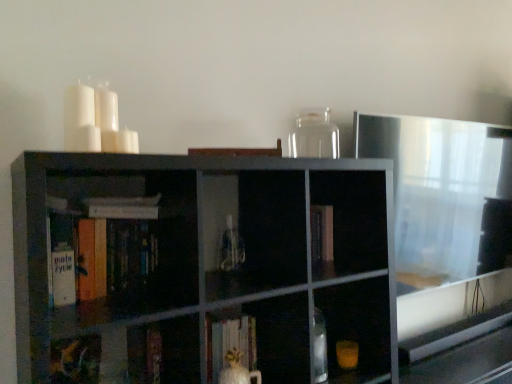
Locate an element on the screen. transparent glass jar at upper center is located at coordinates (314, 135).

The width and height of the screenshot is (512, 384). What do you see at coordinates (314, 135) in the screenshot? I see `transparent glass jar at upper center` at bounding box center [314, 135].

Identify the location of white matte book at upper left, acting as the 2th book starting from the top. (123, 207).

Describe the element at coordinates (229, 344) in the screenshot. This screenshot has height=384, width=512. I see `white matte book at center, positioned as the fourth book in top-to-bottom order` at that location.

Find the location of a particular element. This screenshot has height=384, width=512. white matte book at left, placed as the 3th book when sorted from top to bottom is located at coordinates (101, 245).

I want to click on hardcover book at center, which appears as the 1th book when viewed from the top, so click(65, 206).

Identify the location of white matte candle at upper left, the 2th candle positioned from the right. This screenshot has height=384, width=512. (80, 120).

Could you tell me if white matte candle at upper left, which ranks as the 2th candle in left-to-right order, is facing white matte book at center, placed as the second book when sorted from bottom to top?

No, white matte candle at upper left, which ranks as the 2th candle in left-to-right order, does not turn towards white matte book at center, placed as the second book when sorted from bottom to top.

Is white matte candle at upper left, the first candle positioned from the right, thinner than white matte book at center, positioned as the fourth book in top-to-bottom order?

Yes, white matte candle at upper left, the first candle positioned from the right, is thinner than white matte book at center, positioned as the fourth book in top-to-bottom order.

Who is smaller, white matte candle at upper left, which ranks as the 2th candle in left-to-right order, or white matte book at center, placed as the second book when sorted from bottom to top?

With smaller size is white matte candle at upper left, which ranks as the 2th candle in left-to-right order.

In the scene shown: Can you confirm if white matte candle at upper left, which ranks as the 2th candle in left-to-right order, is shorter than white matte book at center, placed as the second book when sorted from bottom to top?

Yes.

Is matte green book at lower left, the fifth book from the top, looking in the opposite direction of white matte candle at upper left, the 2th candle positioned from the right?

No.

Is point (82, 349) closer or farther from the camera than point (70, 100)?

Clearly, point (82, 349) is more distant from the camera than point (70, 100).

This screenshot has width=512, height=384. In order to click on the 2nd candle positioned above the matte green book at lower left, the 1th book positioned from the bottom (from a real-world perspective) in this screenshot , I will do `click(80, 120)`.

Could you tell me if transparent glass jar at upper center is turned towards white matte candle at upper left, the first candle positioned from the right?

No, transparent glass jar at upper center is not aimed at white matte candle at upper left, the first candle positioned from the right.

From a real-world perspective, which is physically above, transparent glass jar at upper center or white matte candle at upper left, the first candle positioned from the right?

From a 3D spatial view, transparent glass jar at upper center is above.

What's the angular difference between transparent glass jar at upper center and white matte candle at upper left, the first candle positioned from the right,'s facing directions?

The angular difference between transparent glass jar at upper center and white matte candle at upper left, the first candle positioned from the right, is 36.4 degrees.

Which point is more forward, (314,131) or (124,151)?

The point (124,151) is in front.

Can hardcover book at center, which is counted as the 5th book, starting from the bottom, be found inside white matte book at center, placed as the second book when sorted from bottom to top?

No, white matte book at center, placed as the second book when sorted from bottom to top, does not contain hardcover book at center, which is counted as the 5th book, starting from the bottom.

Does white matte book at center, positioned as the fourth book in top-to-bottom order, have a smaller size compared to hardcover book at center, which is counted as the 5th book, starting from the bottom?

Actually, white matte book at center, positioned as the fourth book in top-to-bottom order, might be larger than hardcover book at center, which is counted as the 5th book, starting from the bottom.

Measure the distance from white matte book at center, positioned as the fourth book in top-to-bottom order, to hardcover book at center, which is counted as the 5th book, starting from the bottom.

They are 24.36 inches apart.

Can you tell me how much white matte book at center, positioned as the fourth book in top-to-bottom order, and hardcover book at center, which is counted as the 5th book, starting from the bottom, differ in facing direction?

The angle between the facing direction of white matte book at center, positioned as the fourth book in top-to-bottom order, and the facing direction of hardcover book at center, which is counted as the 5th book, starting from the bottom, is 0.000618 degrees.

The height and width of the screenshot is (384, 512). Identify the location of book that is the 2nd one below the matte black bookshelf at center (from a real-world perspective). pos(229,344).

What's the angular difference between white matte book at center, placed as the second book when sorted from bottom to top, and matte black bookshelf at center's facing directions?

The angle between the facing direction of white matte book at center, placed as the second book when sorted from bottom to top, and the facing direction of matte black bookshelf at center is 2.88 degrees.

Who is taller, white matte book at center, placed as the second book when sorted from bottom to top, or matte black bookshelf at center?

Standing taller between the two is matte black bookshelf at center.

From the image's perspective, which one is positioned lower, white matte book at center, placed as the second book when sorted from bottom to top, or matte black bookshelf at center?

white matte book at center, placed as the second book when sorted from bottom to top, from the image's perspective.

Which of these two, white matte candle at upper left, which ranks as the 2th candle in left-to-right order, or white matte candle at upper left, the 2th candle positioned from the right, is bigger?

Bigger between the two is white matte candle at upper left, the 2th candle positioned from the right.

Can you confirm if white matte candle at upper left, the first candle positioned from the right, is positioned to the left of white matte candle at upper left, the 2th candle positioned from the right?

No, white matte candle at upper left, the first candle positioned from the right, is not to the left of white matte candle at upper left, the 2th candle positioned from the right.

Considering the sizes of white matte candle at upper left, which ranks as the 2th candle in left-to-right order, and white matte candle at upper left, which appears as the first candle when viewed from the left, in the image, is white matte candle at upper left, which ranks as the 2th candle in left-to-right order, taller or shorter than white matte candle at upper left, which appears as the first candle when viewed from the left,?

Clearly, white matte candle at upper left, which ranks as the 2th candle in left-to-right order, is shorter compared to white matte candle at upper left, which appears as the first candle when viewed from the left.

Are white matte candle at upper left, the first candle positioned from the right, and white matte candle at upper left, which appears as the first candle when viewed from the left, far apart?

Actually, white matte candle at upper left, the first candle positioned from the right, and white matte candle at upper left, which appears as the first candle when viewed from the left, are a little close together.

Considering the relative sizes of white matte candle at upper left, the first candle positioned from the right, and matte black bookshelf at center in the image provided, is white matte candle at upper left, the first candle positioned from the right, taller than matte black bookshelf at center?

In fact, white matte candle at upper left, the first candle positioned from the right, may be shorter than matte black bookshelf at center.

From the image's perspective, relative to matte black bookshelf at center, is white matte candle at upper left, the first candle positioned from the right, above or below?

white matte candle at upper left, the first candle positioned from the right, is above matte black bookshelf at center.

Is white matte candle at upper left, which ranks as the 2th candle in left-to-right order, smaller than matte black bookshelf at center?

Correct, white matte candle at upper left, which ranks as the 2th candle in left-to-right order, occupies less space than matte black bookshelf at center.

From a real-world perspective, is white matte candle at upper left, which ranks as the 2th candle in left-to-right order, under matte black bookshelf at center?

No, from a real-world perspective, white matte candle at upper left, which ranks as the 2th candle in left-to-right order, is not below matte black bookshelf at center.

From the image's perspective, count 1st candles upward from the white matte book at center, placed as the second book when sorted from bottom to top, and point to it. Please provide its 2D coordinates.

[(127, 141)]

This screenshot has width=512, height=384. Identify the location of the 2nd candle in front of the matte green book at lower left, the 1th book positioned from the bottom. (80, 120).

Estimate the real-world distances between objects in this image. Which object is closer to matte black bookshelf at center, white matte candle at upper left, which ranks as the 2th candle in left-to-right order, or white matte candle at upper left, which appears as the first candle when viewed from the left?

Based on the image, white matte candle at upper left, which ranks as the 2th candle in left-to-right order, appears to be nearer to matte black bookshelf at center.

Looking at the image, which one is located closer to white matte book at center, positioned as the fourth book in top-to-bottom order, matte green book at lower left, the fifth book from the top, or hardcover book at center, which appears as the 1th book when viewed from the top?

The object closer to white matte book at center, positioned as the fourth book in top-to-bottom order, is matte green book at lower left, the fifth book from the top.

From the picture: Which object lies further to the anchor point white matte candle at upper left, which appears as the first candle when viewed from the left, white matte candle at upper left, the first candle positioned from the right, or white matte book at left, the third book in the bottom-to-top sequence?

Among the two, white matte book at left, the third book in the bottom-to-top sequence, is located further to white matte candle at upper left, which appears as the first candle when viewed from the left.

From the image, which object appears to be nearer to transparent glass jar at upper center, white matte book at center, placed as the second book when sorted from bottom to top, or white matte book at left, placed as the 3th book when sorted from top to bottom?

white matte book at center, placed as the second book when sorted from bottom to top, is closer to transparent glass jar at upper center.

From the image, which object appears to be farther from transparent glass jar at upper center, hardcover book at center, which is counted as the 5th book, starting from the bottom, or matte black bookshelf at center?

hardcover book at center, which is counted as the 5th book, starting from the bottom, is further to transparent glass jar at upper center.

Which object lies nearer to the anchor point white matte candle at upper left, the 2th candle positioned from the right, white matte candle at upper left, the first candle positioned from the right, or hardcover book at center, which is counted as the 5th book, starting from the bottom?

Based on the image, white matte candle at upper left, the first candle positioned from the right, appears to be nearer to white matte candle at upper left, the 2th candle positioned from the right.

Estimate the real-world distances between objects in this image. Which object is closer to white matte book at upper left, arranged as the 4th book when ordered from the bottom, white matte candle at upper left, the first candle positioned from the right, or transparent glass jar at upper center?

white matte candle at upper left, the first candle positioned from the right, is positioned closer to the anchor white matte book at upper left, arranged as the 4th book when ordered from the bottom.

Looking at the image, which one is located further to white matte book at center, positioned as the fourth book in top-to-bottom order, matte green book at lower left, the fifth book from the top, or white matte book at upper left, acting as the 2th book starting from the top?

The object further to white matte book at center, positioned as the fourth book in top-to-bottom order, is white matte book at upper left, acting as the 2th book starting from the top.

At what (x,y) coordinates should I click in order to perform the action: click on shelf between white matte book at left, placed as the 3th book when sorted from top to bottom, and transparent glass jar at upper center, in the horizontal direction. Please return your answer as a coordinate pair (x, y). Looking at the image, I should click on (208, 265).

You are a GUI agent. You are given a task and a screenshot of the screen. Output one action in this format:
    pyautogui.click(x=<x>, y=<y>)
    Task: Click on the shelf between transparent glass jar at upper center and white matte book at center, positioned as the fourth book in top-to-bottom order, in the up-down direction
    The width and height of the screenshot is (512, 384).
    Given the screenshot: What is the action you would take?
    pyautogui.click(x=208, y=265)

Find the location of a particular element. candle that lies between white matte candle at upper left, the 2th candle positioned from the right, and matte green book at lower left, the 1th book positioned from the bottom, from top to bottom is located at coordinates (127, 141).

Where is `shelf between white matte candle at upper left, the 2th candle positioned from the right, and white matte book at center, positioned as the fourth book in top-to-bottom order, in the vertical direction`? The image size is (512, 384). shelf between white matte candle at upper left, the 2th candle positioned from the right, and white matte book at center, positioned as the fourth book in top-to-bottom order, in the vertical direction is located at coordinates (208, 265).